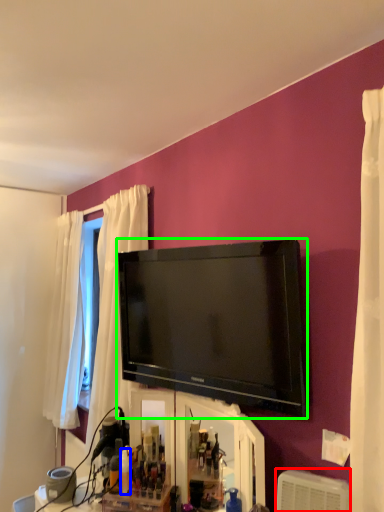
Question: Which object is positioned closest to air conditioner (highlighted by a red box)? Select from toiletry (highlighted by a blue box) and television (highlighted by a green box).

Choices:
 (A) toiletry
 (B) television

Answer: (B)